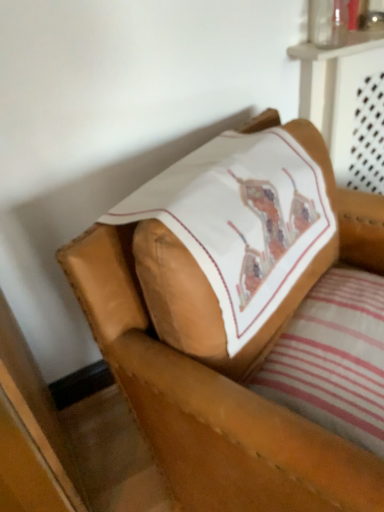
This screenshot has height=512, width=384. Find the location of `leather cushion at center`. leather cushion at center is located at coordinates (209, 406).

This screenshot has width=384, height=512. What do you see at coordinates (209, 406) in the screenshot?
I see `leather cushion at center` at bounding box center [209, 406].

In order to click on leather cushion at center in this screenshot , I will do [x=209, y=406].